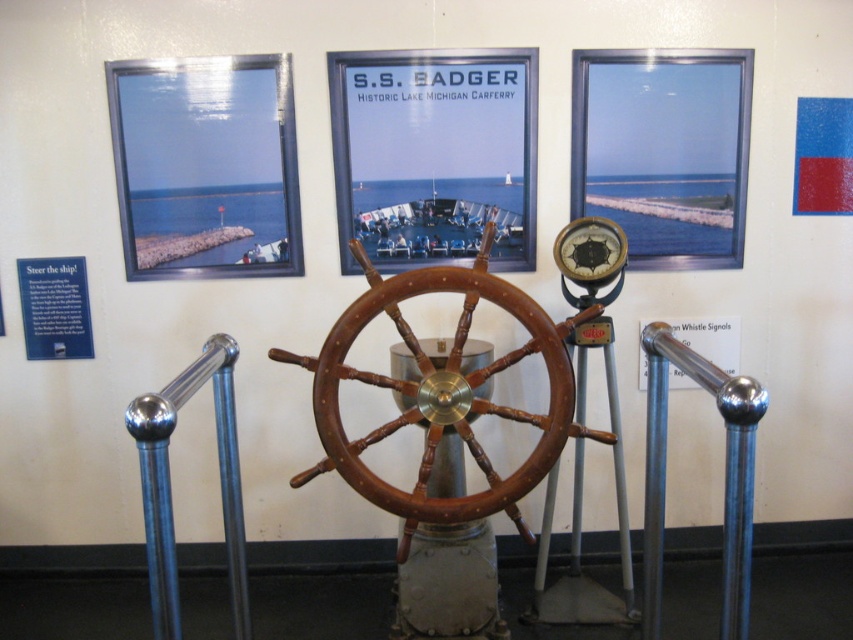
Question: Which object is closer to the camera taking this photo?

Choices:
 (A) polished metal pole at center
 (B) brown polished wood at center
 (C) polished metal pole at left
 (D) matte black gauge at center

Answer: (C)

Question: Considering the real-world distances, which object is closest to the polished metal pole at left?

Choices:
 (A) brown polished wood at center
 (B) polished metal pole at center

Answer: (A)

Question: Can you confirm if polished metal pole at center is bigger than matte black gauge at center?

Choices:
 (A) no
 (B) yes

Answer: (B)

Question: In this image, where is brown polished wood at center located relative to polished metal pole at center?

Choices:
 (A) left
 (B) right

Answer: (A)

Question: Which point appears closest to the camera in this image?

Choices:
 (A) click(734, 564)
 (B) click(577, 241)
 (C) click(155, 496)
 (D) click(434, 515)

Answer: (C)

Question: Can you confirm if polished metal pole at left is thinner than matte black gauge at center?

Choices:
 (A) no
 (B) yes

Answer: (B)